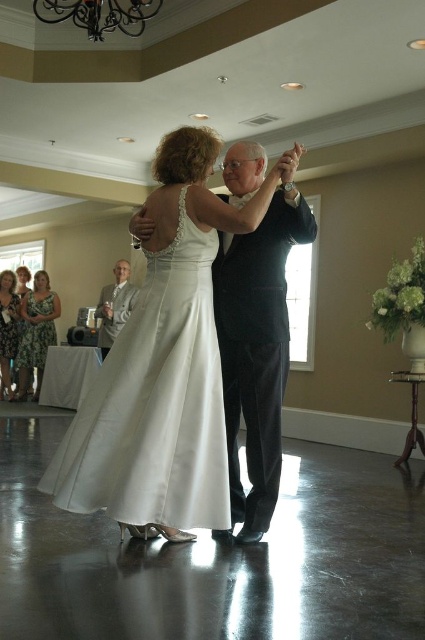
Based on the photo, you are a photographer at the event and need to position yourself to capture the satin white dress at center. Based on its location coordinates, where should you aim your camera?

The satin white dress at center is located at point 0.633 on the x axis and 0.365 on the y axis, so aim your camera towards those coordinates to capture it.

You are at the event and want to locate the black satin suit at center. According to the coordinates provided, where should you look?

You should look at point (257,346) to find the black satin suit at center.

You are a photographer at the event and need to capture a photo that includes both the satin white dress at center and the printed floral dress at lower left. Based on their positions, which dress should you position closer to the left side of the frame to ensure both are visible?

The printed floral dress at lower left should be positioned closer to the left side of the frame since the satin white dress at center is already to the right of it.